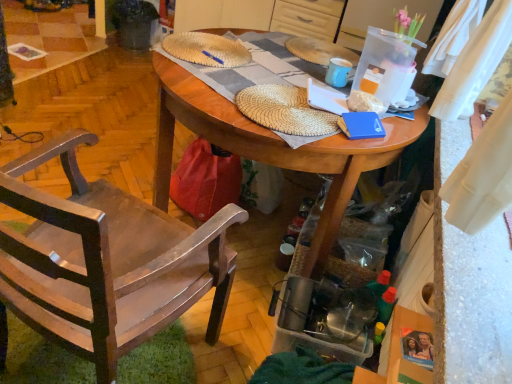
What do you see at coordinates (134, 23) in the screenshot? I see `dark gray plastic trash can at upper left` at bounding box center [134, 23].

The height and width of the screenshot is (384, 512). Describe the element at coordinates (285, 110) in the screenshot. I see `woven straw hat at center, which is the second hat from back to front` at that location.

Locate an element on the screen. Image resolution: width=512 pixels, height=384 pixels. woven straw hat at upper center, marked as the second hat in a front-to-back arrangement is located at coordinates (206, 49).

Measure the distance between point (x=210, y=56) and camera.

The distance of point (x=210, y=56) from camera is 1.68 meters.

The width and height of the screenshot is (512, 384). Find the location of `matte blue mug at upper center`. matte blue mug at upper center is located at coordinates (338, 72).

This screenshot has width=512, height=384. I want to click on chair that is on the left side of blue matte book at center, so click(x=106, y=261).

Considering the relative sizes of wooden chair at left and blue matte book at center in the image provided, is wooden chair at left smaller than blue matte book at center?

Incorrect, wooden chair at left is not smaller in size than blue matte book at center.

Is wooden chair at left situated inside blue matte book at center or outside?

The correct answer is: outside.

Does blue matte book at center contain wooden chair at left?

That's incorrect, wooden chair at left is not inside blue matte book at center.

Is blue matte book at center closer to the viewer compared to wooden chair at left?

That is False.

From the image's perspective, is blue matte book at center located above wooden chair at left?

Indeed, from the image's perspective, blue matte book at center is shown above wooden chair at left.

Is blue matte book at center not near wooden chair at left?

No, blue matte book at center is not far away from wooden chair at left.

How different are the orientations of blue plastic pen at center and blue matte book at center in degrees?

blue plastic pen at center and blue matte book at center are facing 114 degrees away from each other.

From the image's perspective, which one is positioned higher, blue plastic pen at center or blue matte book at center?

blue plastic pen at center appears higher in the image.

Measure the distance from blue plastic pen at center to blue matte book at center.

The distance of blue plastic pen at center from blue matte book at center is 24.07 inches.

Can you confirm if blue plastic pen at center is bigger than blue matte book at center?

Actually, blue plastic pen at center might be smaller than blue matte book at center.

How many degrees apart are the facing directions of woven straw hat at upper center, the first hat from the back, and wooden table at center?

There is a 6.85-degree angle between the facing directions of woven straw hat at upper center, the first hat from the back, and wooden table at center.

How distant is woven straw hat at upper center, marked as the second hat in a front-to-back arrangement, from wooden table at center?

woven straw hat at upper center, marked as the second hat in a front-to-back arrangement, is 13.83 inches from wooden table at center.

From the picture: From a real-world perspective, is woven straw hat at upper center, which is the 2th hat in bottom-to-top order, located beneath wooden table at center?

Incorrect, from a real-world perspective, woven straw hat at upper center, which is the 2th hat in bottom-to-top order, is higher than wooden table at center.

Considering the relative positions of woven straw hat at upper center, the first hat from the back, and wooden table at center in the image provided, is woven straw hat at upper center, the first hat from the back, behind wooden table at center?

Yes, it is behind wooden table at center.

Considering the relative sizes of woven straw hat at center, which is the second hat in top-to-bottom order, and blue plastic pen at center in the image provided, is woven straw hat at center, which is the second hat in top-to-bottom order, thinner than blue plastic pen at center?

In fact, woven straw hat at center, which is the second hat in top-to-bottom order, might be wider than blue plastic pen at center.

Who is smaller, woven straw hat at center, the first hat when ordered from front to back, or blue plastic pen at center?

blue plastic pen at center is smaller.

Can you confirm if woven straw hat at center, which is the second hat in top-to-bottom order, is positioned to the left of blue plastic pen at center?

No, woven straw hat at center, which is the second hat in top-to-bottom order, is not to the left of blue plastic pen at center.

From a real-world perspective, does woven straw hat at center, which is the second hat in top-to-bottom order, stand above blue plastic pen at center?

Incorrect, from a real-world perspective, woven straw hat at center, which is the second hat in top-to-bottom order, is lower than blue plastic pen at center.

In the scene shown: Relative to matte blue mug at upper center, is blue plastic pen at center in front or behind?

blue plastic pen at center is positioned farther from the viewer than matte blue mug at upper center.

Does blue plastic pen at center appear on the right side of matte blue mug at upper center?

No.

Would you say blue plastic pen at center is inside or outside matte blue mug at upper center?

blue plastic pen at center is spatially situated outside matte blue mug at upper center.

Considering the relative sizes of blue plastic pen at center and matte blue mug at upper center in the image provided, is blue plastic pen at center wider than matte blue mug at upper center?

In fact, blue plastic pen at center might be narrower than matte blue mug at upper center.

From a real-world perspective, who is located lower, blue plastic pen at center or wooden table at center?

In real-world perspective, wooden table at center is lower.

Choose the correct answer: Is blue plastic pen at center inside wooden table at center or outside it?

blue plastic pen at center is inside wooden table at center.

Is blue plastic pen at center further to camera compared to wooden table at center?

Yes, blue plastic pen at center is further from the camera.

From the image's perspective, relative to wooden table at center, is blue plastic pen at center above or below?

From the image's perspective, blue plastic pen at center appears above wooden table at center.

In order to click on book lying on the right of wooden chair at left in this screenshot , I will do `click(361, 125)`.

Identify the location of book above the wooden chair at left (from the image's perspective). (361, 125).

Looking at this image, looking at the image, which one is located closer to blue matte book at center, matte blue mug at upper center or woven straw hat at upper center, the first hat from the back?

matte blue mug at upper center lies closer to blue matte book at center than the other object.

When comparing their distances from woven straw hat at upper center, which is the 2th hat in bottom-to-top order, does dark gray plastic trash can at upper left or wooden table at center seem closer?

wooden table at center lies closer to woven straw hat at upper center, which is the 2th hat in bottom-to-top order, than the other object.

Based on their spatial positions, is wooden chair at left or blue plastic pen at center closer to wooden table at center?

wooden chair at left is positioned closer to the anchor wooden table at center.

From the image, which object appears to be nearer to blue plastic pen at center, dark gray plastic trash can at upper left or woven straw hat at upper center, the first hat from the back?

woven straw hat at upper center, the first hat from the back, is closer to blue plastic pen at center.

Looking at the image, which one is located further to wooden table at center, woven straw hat at upper center, marked as the second hat in a front-to-back arrangement, or blue matte book at center?

Among the two, woven straw hat at upper center, marked as the second hat in a front-to-back arrangement, is located further to wooden table at center.

Based on their spatial positions, is blue matte book at center or wooden chair at left closer to blue plastic pen at center?

blue matte book at center is positioned closer to the anchor blue plastic pen at center.

From the picture: Considering their positions, is woven straw hat at upper center, which is the 2th hat in bottom-to-top order, positioned closer to blue matte book at center than blue plastic pen at center?

blue plastic pen at center is closer to blue matte book at center.

Based on their spatial positions, is matte blue mug at upper center or blue matte book at center closer to wooden chair at left?

blue matte book at center lies closer to wooden chair at left than the other object.

I want to click on pen located between blue matte book at center and dark gray plastic trash can at upper left in the depth direction, so click(x=213, y=57).

Where is `book between woven straw hat at center, which is the second hat in top-to-bottom order, and matte blue mug at upper center in the front-back direction`? This screenshot has height=384, width=512. book between woven straw hat at center, which is the second hat in top-to-bottom order, and matte blue mug at upper center in the front-back direction is located at coordinates (361, 125).

Where is `coffee cup positioned between wooden table at center and dark gray plastic trash can at upper left from near to far`? Image resolution: width=512 pixels, height=384 pixels. coffee cup positioned between wooden table at center and dark gray plastic trash can at upper left from near to far is located at coordinates (338, 72).

I want to click on coffee cup between woven straw hat at upper center, which is the first hat in top-to-bottom order, and blue matte book at center, so click(338, 72).